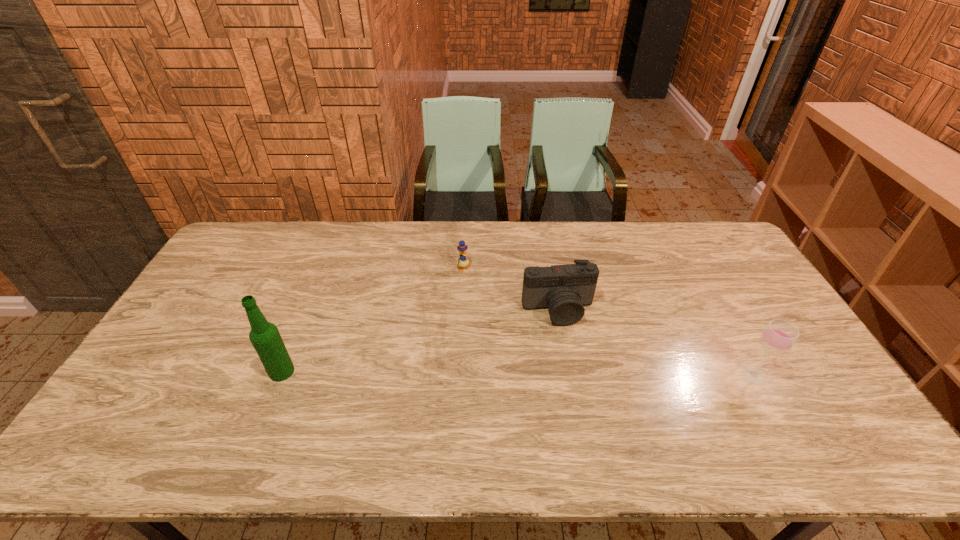
Locate an element on the screen. The image size is (960, 540). free point between the wineglass and the second shortest object is located at coordinates (656, 343).

Identify the location of vacant space that's between the wineglass and the second farthest object. Image resolution: width=960 pixels, height=540 pixels. (656, 343).

This screenshot has height=540, width=960. I want to click on free space between the duckling and the tallest object, so click(x=372, y=320).

Locate an element on the screen. free area in between the second object from left to right and the beer bottle is located at coordinates (372, 320).

The image size is (960, 540). Identify the location of object that stands as the second closest to the shortest object. (264, 336).

Identify which object is located as the third nearest to the third object from left to right. Please provide its 2D coordinates. Your answer should be formatted as a tuple, i.e. [(x, y)], where the tuple contains the x and y coordinates of a point satisfying the conditions above.

[(264, 336)]

Find the location of a particular element. The height and width of the screenshot is (540, 960). free location that satisfies the following two spatial constraints: 1. on the front side of the camera; 2. on the left side of the third object from right to left is located at coordinates (462, 310).

This screenshot has width=960, height=540. I want to click on free space that satisfies the following two spatial constraints: 1. on the front side of the shortest object; 2. on the right side of the camera, so click(462, 310).